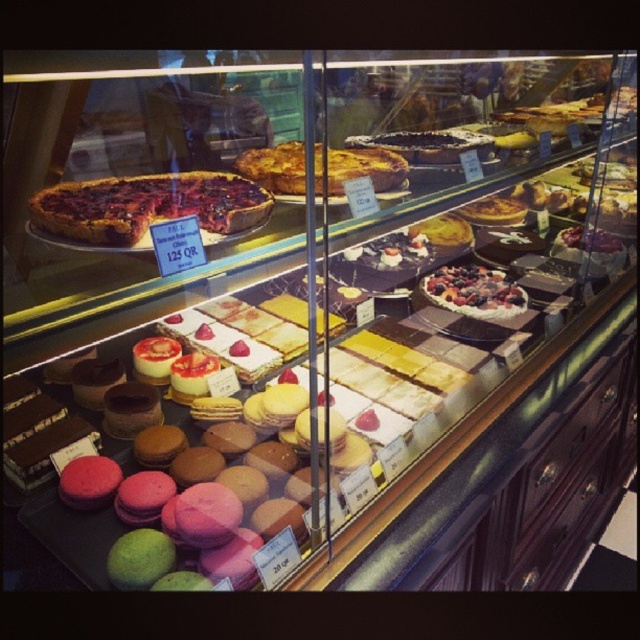
Please look at the top shelf in the bakery display case. There are pies and tarts arranged on white plates. Can you identify which pastry is located at the coordinates point (145, 205)?

The point (145, 205) indicates the dark chocolate pie at upper left.